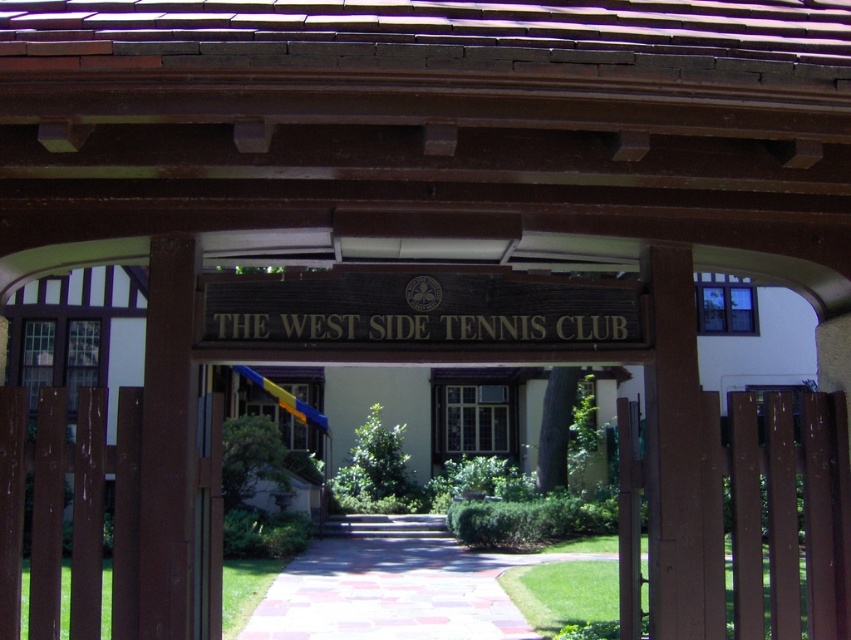
In the scene shown: Does brown polished wood sign at center appear on the right side of clear glass window at center?

In fact, brown polished wood sign at center is to the left of clear glass window at center.

Find the location of a particular element. This screenshot has width=851, height=640. brown polished wood sign at center is located at coordinates (420, 312).